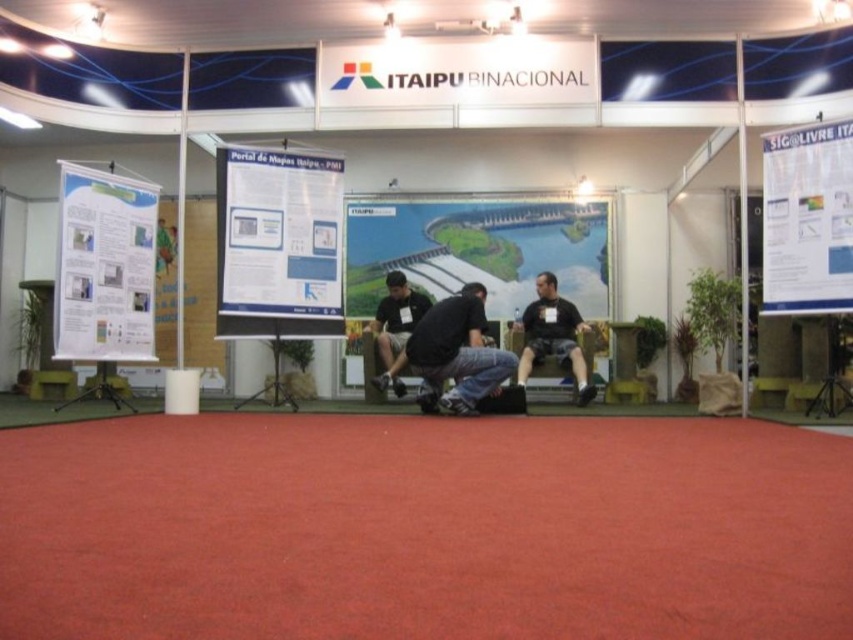
You are at the ITAIPU BINACIONAL booth and want to read both the white paper poster at center and the white paper poster at left. Which poster should you look at first if you want to start with the larger one?

The white paper poster at left is larger, so you should start with the white paper poster at left.

You are at the ITAIPU BINACIONAL booth and need to hand a document to someone standing by the black matte shirt at center. You are currently holding a white paper at upper right. Can you directly hand it to them without moving the paper?

The white paper at upper right is to the right of the black matte shirt at center, so you would need to move the white paper at upper right to the left to hand it to the person by the black matte shirt at center.